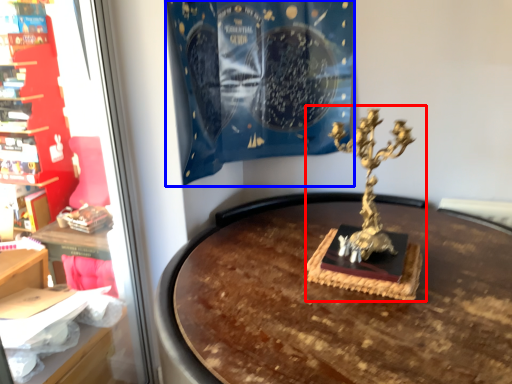
Question: Which object appears farthest to the camera in this image, sculpture (highlighted by a red box) or curtain (highlighted by a blue box)?

Choices:
 (A) sculpture
 (B) curtain

Answer: (B)